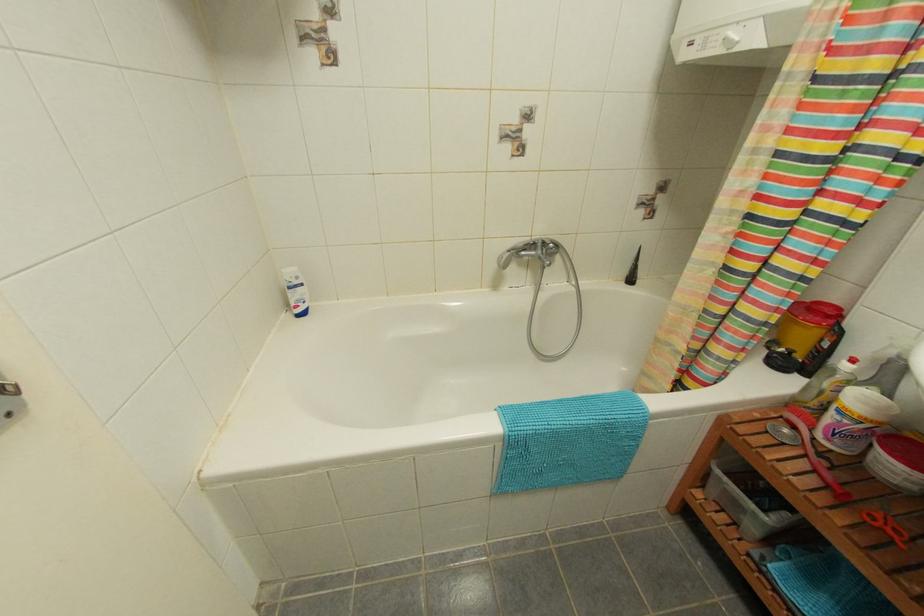
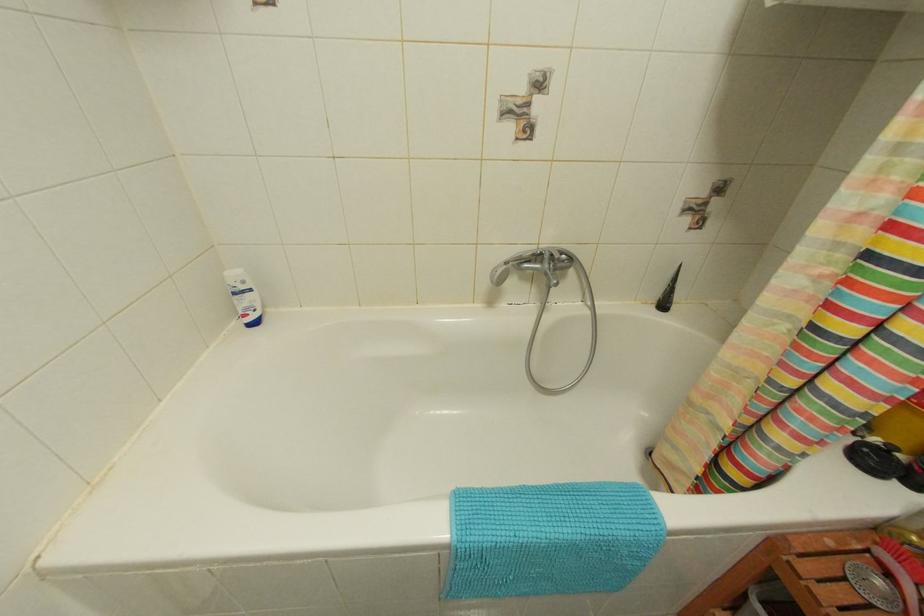
What movement of the cameraman would produce the second image?

The movement direction of the cameraman is right, forward.